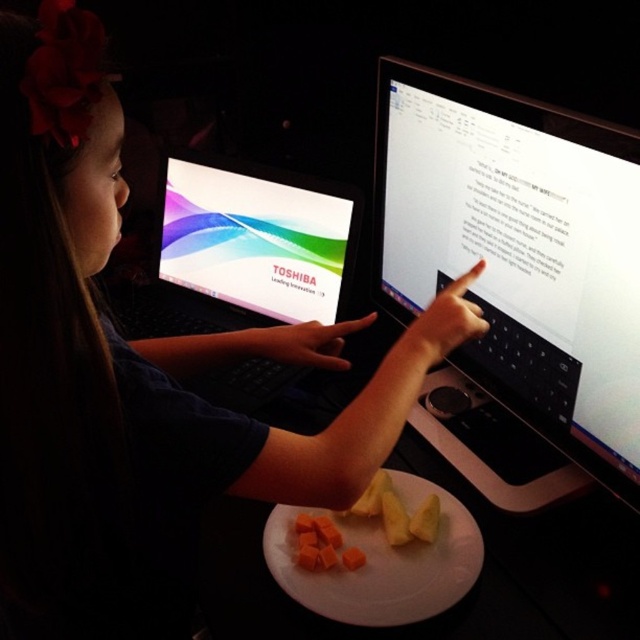
You are a chef preparing a meal and need to place the orange rubbery carrot at center on the white matte plate at center. Given their sizes, will the carrot fit comfortably on the plate?

The white matte plate at center is larger in size than the orange rubbery carrot at center, so yes, the carrot will fit comfortably on the plate.

You are a chef preparing a dish and need to place an orange rubbery carrot at center on top of a white matte plate at center. Based on the scene described, can you successfully do this without moving any other items?

The white matte plate at center is below the orange rubbery carrot at center, so yes, the carrot is already placed on top of the plate.

You are a delivery person who needs to place a small package on the desk without disturbing the black plastic laptop at center. The package requires at least 10 centimeters of space between it and any object on the desk. Is there enough space available on the desk to place the package?

The black plastic laptop at center is 95.55 centimeters away from the viewer, but the question requires knowing the distance between the package and other objects on the desk. Since the description only provides the distance between the laptop and the viewer, there is insufficient information to determine if there is enough space to place the package with the required 10 centimeters clearance from the laptop and other objects.